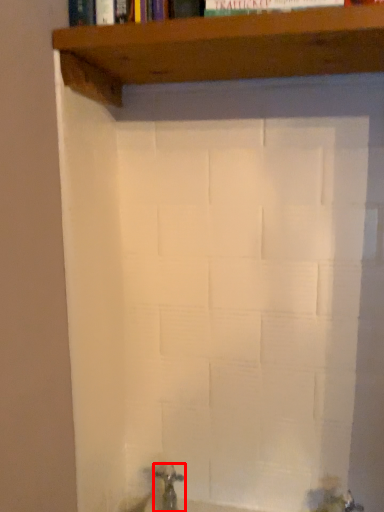
Question: Where is tap (annotated by the red box) located in relation to shelf in the image?

Choices:
 (A) left
 (B) right

Answer: (A)